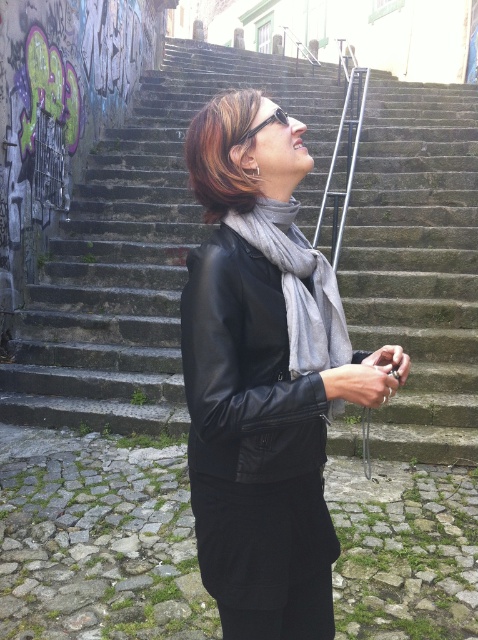
Question: Which point appears farthest from the camera in this image?

Choices:
 (A) (295, 230)
 (B) (263, 115)
 (C) (390, 164)

Answer: (C)

Question: Which object is positioned farthest from the gray wool scarf at center?

Choices:
 (A) black leather jacket at center
 (B) concrete steps at center

Answer: (B)

Question: Estimate the real-world distances between objects in this image. Which object is closer to the concrete steps at center?

Choices:
 (A) black leather jacket at center
 (B) gray wool scarf at center

Answer: (A)

Question: Does black leather jacket at center lie in front of gray wool scarf at center?

Choices:
 (A) yes
 (B) no

Answer: (A)

Question: Is black leather jacket at center closer to the viewer compared to gray wool scarf at center?

Choices:
 (A) yes
 (B) no

Answer: (A)

Question: From the image, what is the correct spatial relationship of black leather jacket at center in relation to gray wool scarf at center?

Choices:
 (A) above
 (B) below

Answer: (B)